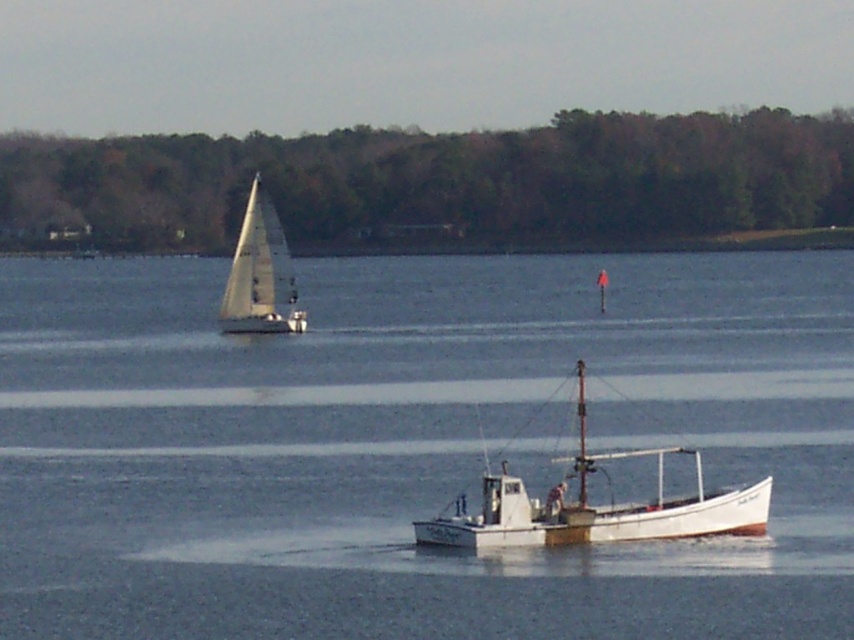
Question: Which object appears farthest from the camera in this image?

Choices:
 (A) white sailboat at upper left
 (B) white matte water at center

Answer: (A)

Question: Considering the relative positions of white matte water at center and white sailboat at upper left in the image provided, where is white matte water at center located with respect to white sailboat at upper left?

Choices:
 (A) left
 (B) right

Answer: (B)

Question: Which of these objects is positioned farthest from the white matte water at center?

Choices:
 (A) white wooden boat at center
 (B) white sailboat at upper left

Answer: (A)

Question: Does white matte water at center come behind white wooden boat at center?

Choices:
 (A) no
 (B) yes

Answer: (A)

Question: Is white matte water at center below white wooden boat at center?

Choices:
 (A) yes
 (B) no

Answer: (B)

Question: Estimate the real-world distances between objects in this image. Which object is closer to the white wooden boat at center?

Choices:
 (A) white sailboat at upper left
 (B) white matte water at center

Answer: (A)